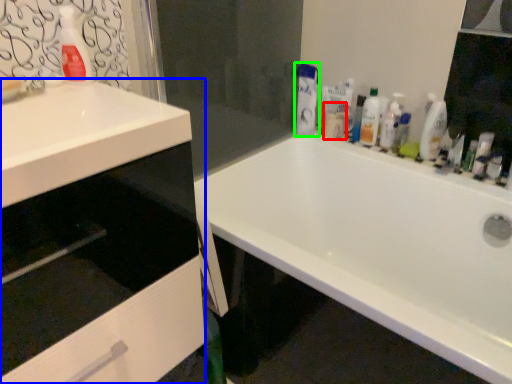
Question: Based on their relative distances, which object is farther from toiletry (highlighted by a red box)? Choose from cabinetry (highlighted by a blue box) and cleaning product (highlighted by a green box).

Choices:
 (A) cabinetry
 (B) cleaning product

Answer: (A)